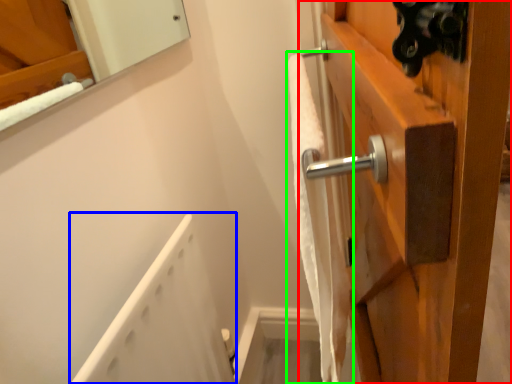
Question: Based on their relative distances, which object is nearer to door (highlighted by a red box)? Choose from bath (highlighted by a blue box) and bath towel (highlighted by a green box).

Choices:
 (A) bath
 (B) bath towel

Answer: (B)